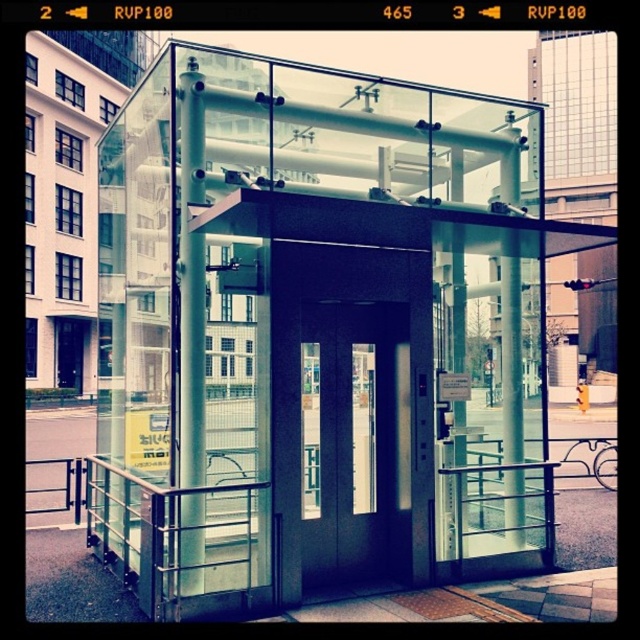
From the picture: You are standing on the sidewalk outside the elevator structure. You want to enter the elevator. Which object, the transparent glass door at center or the metallic silver pole at center, is closer to you as you approach the entrance?

The transparent glass door at center is closer to you because it is further to the viewer than the metallic silver pole at center, meaning it is positioned in front of the pole when approaching the entrance.

You are standing on the sidewalk and looking at the transparent glass elevator at center and the clear glass pillar at center. Which object is closer to you?

The transparent glass elevator at center is closer to the viewer than the clear glass pillar at center.